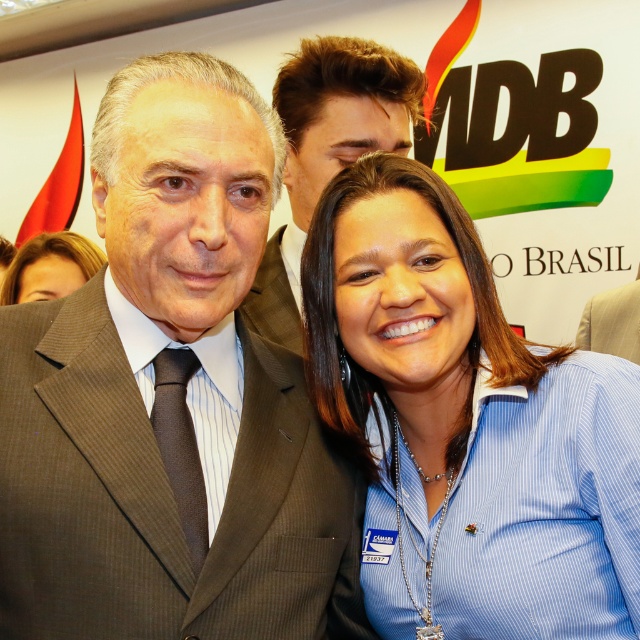
Question: Is brown suit at center to the right of brown textured tie at center from the viewer's perspective?

Choices:
 (A) yes
 (B) no

Answer: (A)

Question: Does blue striped shirt at center appear under light brown textured fabric business suit at center?

Choices:
 (A) yes
 (B) no

Answer: (A)

Question: Which point is closer to the camera?

Choices:
 (A) (230, 280)
 (B) (625, 317)
 (C) (188, 490)

Answer: (A)

Question: Which of the following is the farthest from the observer?

Choices:
 (A) (401, 497)
 (B) (42, 392)
 (C) (173, 435)

Answer: (A)

Question: Which object is closer to the camera taking this photo?

Choices:
 (A) light brown textured fabric business suit at center
 (B) matte brown hair at lower left
 (C) brown suit at center
 (D) blue striped shirt at center

Answer: (D)

Question: Can you confirm if brown pinstripe suit at center is thinner than brown suit at center?

Choices:
 (A) no
 (B) yes

Answer: (A)